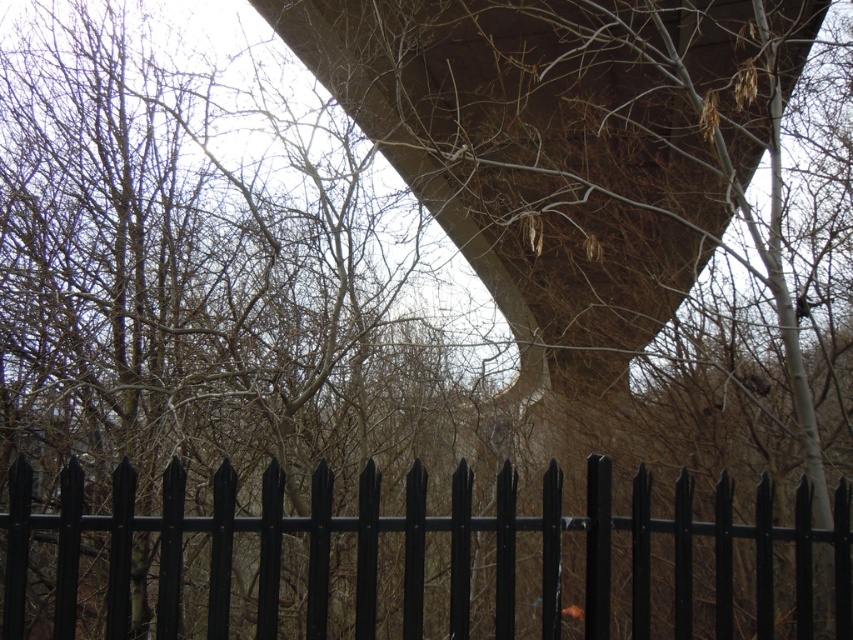
Question: Does brown/dry branches at upper center appear on the right side of black metal fence at lower center?

Choices:
 (A) no
 (B) yes

Answer: (A)

Question: Among these points, which one is farthest from the camera?

Choices:
 (A) (461, 620)
 (B) (128, 236)

Answer: (B)

Question: Among these points, which one is nearest to the camera?

Choices:
 (A) (579, 528)
 (B) (38, 339)

Answer: (A)

Question: Can you confirm if brown/dry branches at upper center is thinner than black metal fence at lower center?

Choices:
 (A) yes
 (B) no

Answer: (A)

Question: Does brown/dry branches at upper center lie behind black metal fence at lower center?

Choices:
 (A) yes
 (B) no

Answer: (A)